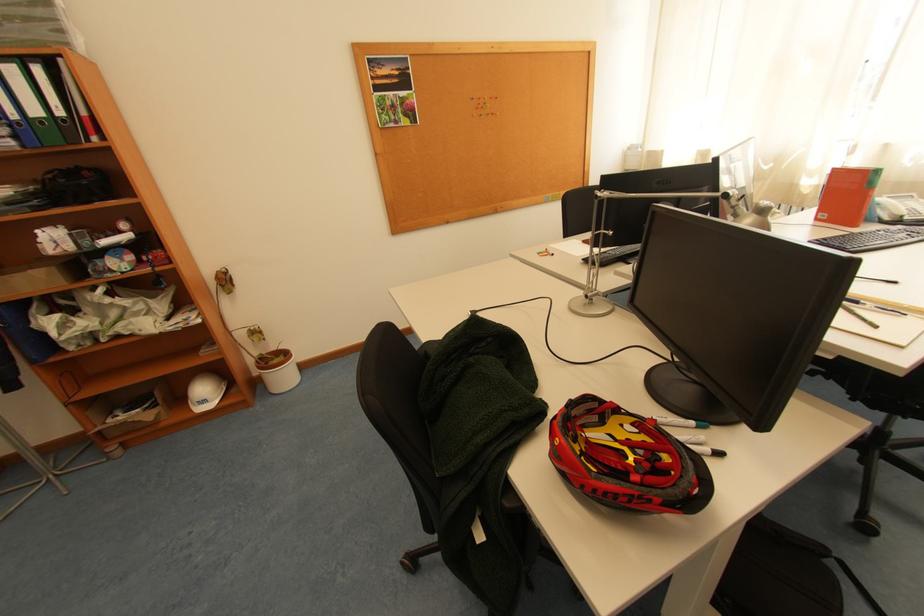
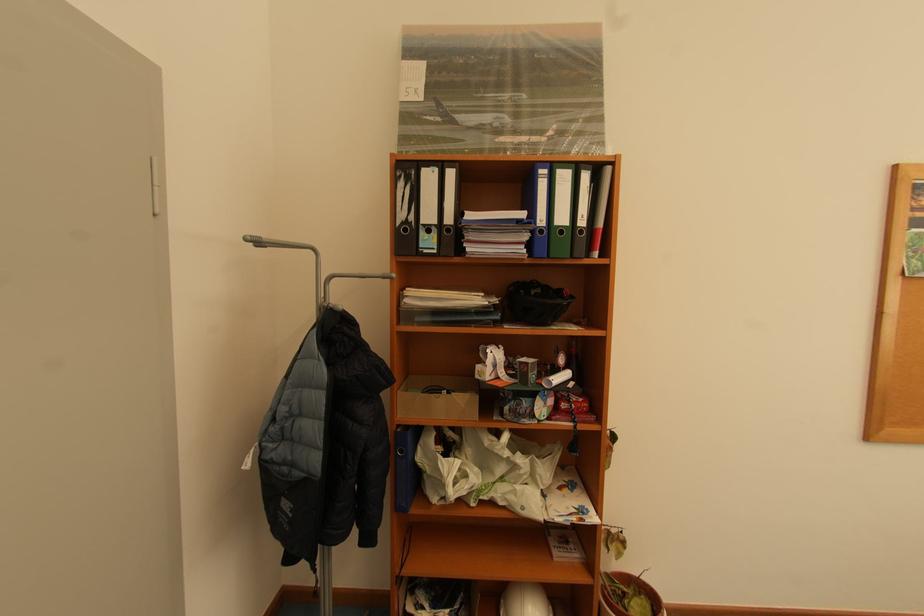
Find the pixel in the second image that matches the point at 66,171 in the first image.

(526, 284)